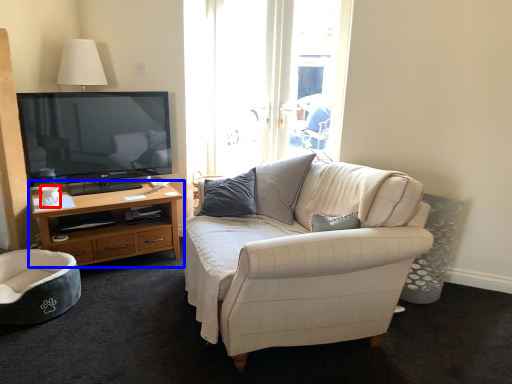
Question: Which point is further to the camera, coffee cup (highlighted by a red box) or cabinetry (highlighted by a blue box)?

Choices:
 (A) coffee cup
 (B) cabinetry

Answer: (A)